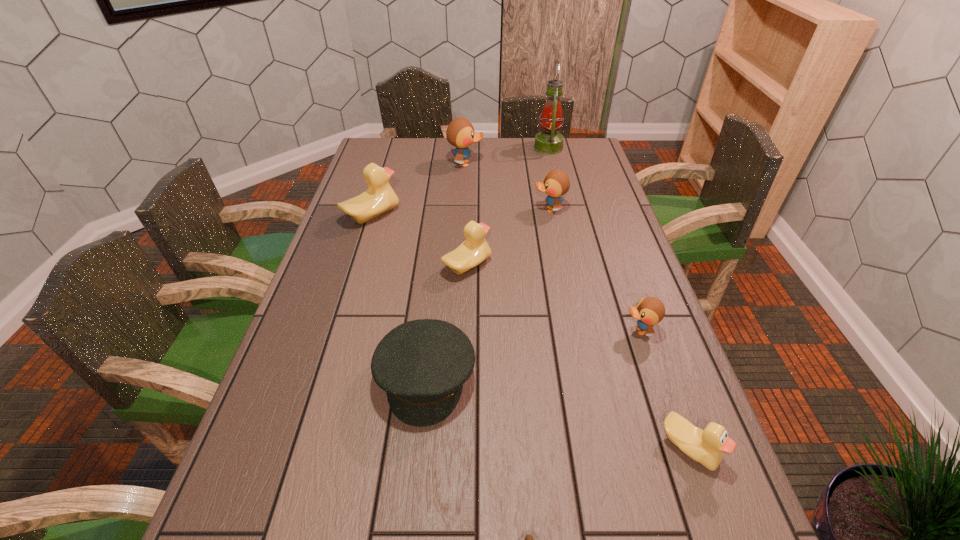
At what (x,y) coordinates should I click in order to perform the action: click on the fifth farthest duck. Please return your answer as a coordinate pair (x, y). Image resolution: width=960 pixels, height=540 pixels. Looking at the image, I should click on (649, 311).

Where is `the rightmost blue duck`? the rightmost blue duck is located at coordinates (649, 311).

This screenshot has width=960, height=540. I want to click on gray beret, so tap(422, 364).

Where is `the smallest beige duck`? Image resolution: width=960 pixels, height=540 pixels. the smallest beige duck is located at coordinates (708, 447).

Where is `the rightmost beige duck`? The width and height of the screenshot is (960, 540). the rightmost beige duck is located at coordinates (708, 447).

Image resolution: width=960 pixels, height=540 pixels. In order to click on vacant space situated 0.270m on the front of the green oil lamp in this screenshot , I will do `click(560, 194)`.

This screenshot has width=960, height=540. Identify the location of free space located 0.100m on the front-facing side of the biggest blue duck. (510, 164).

Where is `free space located 0.320m at the beak of the leftmost duck`? This screenshot has height=540, width=960. free space located 0.320m at the beak of the leftmost duck is located at coordinates (495, 215).

Locate an element on the screen. The height and width of the screenshot is (540, 960). free point located on the front-facing side of the second blue duck from right to left is located at coordinates (452, 210).

At what (x,y) coordinates should I click in order to perform the action: click on vacant space located on the front-facing side of the second blue duck from right to left. Please return your answer as a coordinate pair (x, y). Looking at the image, I should click on (462, 210).